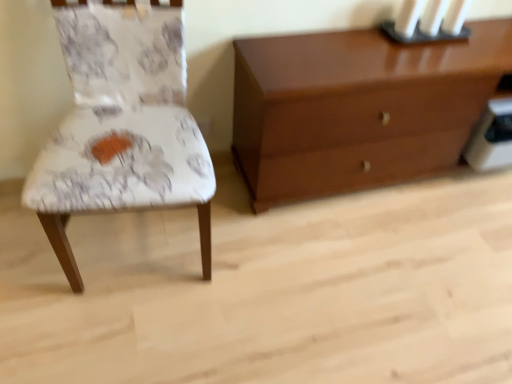
The width and height of the screenshot is (512, 384). What are the coordinates of `vacant space in front of glossy wood chest of drawers at upper right` in the screenshot? It's located at (374, 269).